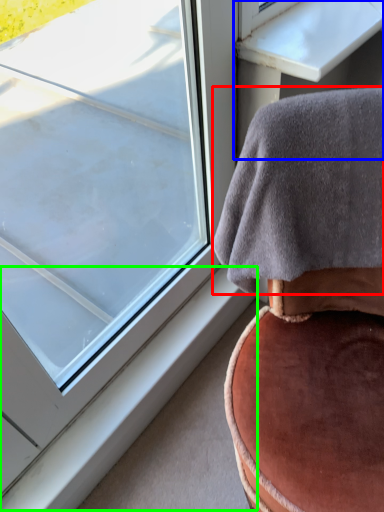
Question: Which object is the closest to the blanket (highlighted by a red box)? Choose among these: table (highlighted by a blue box) or window sill (highlighted by a green box).

Choices:
 (A) table
 (B) window sill

Answer: (A)